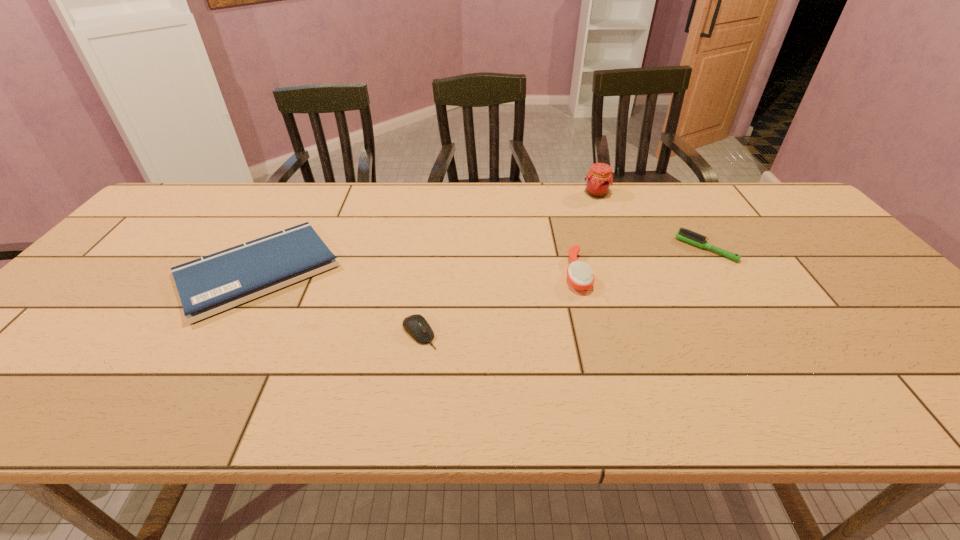
I want to click on the second object from right to left, so click(x=599, y=179).

At what (x,y) coordinates should I click in order to perform the action: click on the tallest object. Please return your answer as a coordinate pair (x, y). Looking at the image, I should click on (599, 179).

Identify the location of the taller hairbrush. (580, 276).

Identify the location of the left hairbrush. (580, 276).

Find the location of a particular element. The image size is (960, 540). the leftmost object is located at coordinates (209, 285).

At what (x,y) coordinates should I click in order to perform the action: click on the right hairbrush. Please return your answer as a coordinate pair (x, y). Looking at the image, I should click on (683, 234).

Find the location of `the shorter hairbrush`. the shorter hairbrush is located at coordinates click(683, 234).

Where is `computer mouse`? This screenshot has width=960, height=540. computer mouse is located at coordinates (416, 326).

You are a GUI agent. You are given a task and a screenshot of the screen. Output one action in this format:
    pyautogui.click(x=<x>, y=<y>)
    Task: Click on the free space located on the right of the jam
    Image resolution: width=960 pixels, height=540 pixels.
    Given the screenshot: What is the action you would take?
    pyautogui.click(x=712, y=194)

Find the location of a particular element. The image size is (960, 540). vacant area situated 0.270m on the back of the third object from right to left is located at coordinates (559, 202).